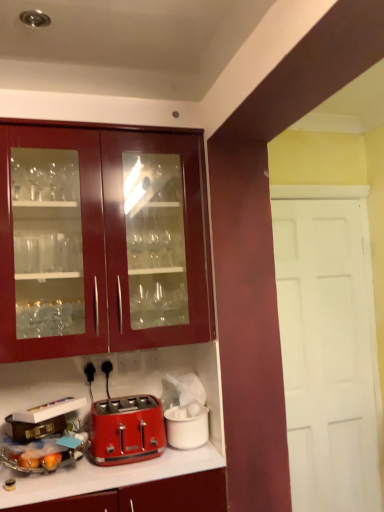
This screenshot has width=384, height=512. What do you see at coordinates (126, 430) in the screenshot? I see `shiny red toaster at lower center` at bounding box center [126, 430].

At what (x,y) coordinates should I click in order to perform the action: click on brown leather suitcase at lower left, the first appliance from the left. Please return your answer as a coordinate pair (x, y). The height and width of the screenshot is (512, 384). Looking at the image, I should click on (34, 428).

Find the location of a particular element. the 2nd appliance counting from the left of the shiny red toaster at lower center is located at coordinates (34, 428).

From the image's perspective, relative to brown leather suitcase at lower left, placed as the 3th appliance when sorted from right to left, is shiny red toaster at lower center above or below?

shiny red toaster at lower center is below brown leather suitcase at lower left, placed as the 3th appliance when sorted from right to left.

Is shiny red toaster at lower center wider than brown leather suitcase at lower left, placed as the 3th appliance when sorted from right to left?

Correct, the width of shiny red toaster at lower center exceeds that of brown leather suitcase at lower left, placed as the 3th appliance when sorted from right to left.

In the image, is shiny red toaster at lower center positioned in front of or behind brown leather suitcase at lower left, placed as the 3th appliance when sorted from right to left?

Clearly, shiny red toaster at lower center is behind brown leather suitcase at lower left, placed as the 3th appliance when sorted from right to left.

From the image's perspective, is matte red toaster at lower left, which is the second appliance from right to left, over white matte ice bucket at lower center, which appears as the third appliance when viewed from the left?

No, from the image's perspective, matte red toaster at lower left, which is the second appliance from right to left, is not on top of white matte ice bucket at lower center, which appears as the third appliance when viewed from the left.

Is matte red toaster at lower left, which is the second appliance from right to left, wider or thinner than white matte ice bucket at lower center, which ranks as the 1th appliance in right-to-left order?

In the image, matte red toaster at lower left, which is the second appliance from right to left, appears to be more narrow than white matte ice bucket at lower center, which ranks as the 1th appliance in right-to-left order.

Choose the correct answer: Is matte red toaster at lower left, which is counted as the second appliance, starting from the left, inside white matte ice bucket at lower center, which ranks as the 1th appliance in right-to-left order, or outside it?

matte red toaster at lower left, which is counted as the second appliance, starting from the left, is spatially situated outside white matte ice bucket at lower center, which ranks as the 1th appliance in right-to-left order.

Between matte red toaster at lower left, which is the second appliance from right to left, and white matte ice bucket at lower center, which appears as the third appliance when viewed from the left, which one is positioned behind?

Positioned behind is white matte ice bucket at lower center, which appears as the third appliance when viewed from the left.

Does shiny red toaster at lower center have a greater width compared to matte red toaster at lower left, which is the second appliance from right to left?

Yes.

Considering the sizes of shiny red toaster at lower center and matte red toaster at lower left, which is counted as the second appliance, starting from the left, in the image, is shiny red toaster at lower center taller or shorter than matte red toaster at lower left, which is counted as the second appliance, starting from the left,?

shiny red toaster at lower center is taller than matte red toaster at lower left, which is counted as the second appliance, starting from the left.

Which appliance is the 1st one when counting from the left side of the shiny red toaster at lower center? Please provide its 2D coordinates.

[(42, 438)]

Is glossy wood cabinet at upper left to the right of matte red toaster at lower left, which is counted as the second appliance, starting from the left, from the viewer's perspective?

Indeed, glossy wood cabinet at upper left is positioned on the right side of matte red toaster at lower left, which is counted as the second appliance, starting from the left.

Is glossy wood cabinet at upper left oriented away from matte red toaster at lower left, which is counted as the second appliance, starting from the left?

No, matte red toaster at lower left, which is counted as the second appliance, starting from the left, is not at the back of glossy wood cabinet at upper left.

Between point (22, 246) and point (6, 441), which one is positioned behind?

The point (6, 441) is farther from the camera.

Measure the distance from glossy wood cabinet at upper left to matte red toaster at lower left, which is counted as the second appliance, starting from the left.

23.52 inches.

Between glossy wood cabinet at upper left and white matte ice bucket at lower center, which ranks as the 1th appliance in right-to-left order, which one has less height?

white matte ice bucket at lower center, which ranks as the 1th appliance in right-to-left order, is shorter.

Does glossy wood cabinet at upper left have a smaller size compared to white matte ice bucket at lower center, which ranks as the 1th appliance in right-to-left order?

No, glossy wood cabinet at upper left is not smaller than white matte ice bucket at lower center, which ranks as the 1th appliance in right-to-left order.

Is glossy wood cabinet at upper left directly adjacent to white matte ice bucket at lower center, which appears as the third appliance when viewed from the left?

No.

Considering the positions of objects glossy wood cabinet at upper left and white matte ice bucket at lower center, which appears as the third appliance when viewed from the left, in the image provided, who is more to the left, glossy wood cabinet at upper left or white matte ice bucket at lower center, which appears as the third appliance when viewed from the left,?

glossy wood cabinet at upper left is more to the left.

Which object is positioned more to the left, brown leather suitcase at lower left, placed as the 3th appliance when sorted from right to left, or glossy wood cabinet at upper left?

From the viewer's perspective, brown leather suitcase at lower left, placed as the 3th appliance when sorted from right to left, appears more on the left side.

At what (x,y) coordinates should I click in order to perform the action: click on cabinetry on the right of brown leather suitcase at lower left, the first appliance from the left. Please return your answer as a coordinate pair (x, y). Looking at the image, I should click on (102, 241).

Is brown leather suitcase at lower left, placed as the 3th appliance when sorted from right to left, oriented towards glossy wood cabinet at upper left?

No, brown leather suitcase at lower left, placed as the 3th appliance when sorted from right to left, is not turned towards glossy wood cabinet at upper left.

Could glossy wood cabinet at upper left be considered to be inside brown leather suitcase at lower left, the first appliance from the left?

No, glossy wood cabinet at upper left is not a part of brown leather suitcase at lower left, the first appliance from the left.

Is brown leather suitcase at lower left, the first appliance from the left, situated inside shiny red toaster at lower center or outside?

brown leather suitcase at lower left, the first appliance from the left, is outside shiny red toaster at lower center.

Can you tell me how much brown leather suitcase at lower left, the first appliance from the left, and shiny red toaster at lower center differ in facing direction?

The facing directions of brown leather suitcase at lower left, the first appliance from the left, and shiny red toaster at lower center are 7.18 degrees apart.

From the picture: Is brown leather suitcase at lower left, placed as the 3th appliance when sorted from right to left, positioned behind shiny red toaster at lower center?

No, it is not.

Identify the location of toaster behind the brown leather suitcase at lower left, placed as the 3th appliance when sorted from right to left. The image size is (384, 512). (126, 430).

I want to click on appliance that is under the white matte ice bucket at lower center, which appears as the third appliance when viewed from the left (from a real-world perspective), so coord(42,438).

From the image, which object appears to be nearer to white matte ice bucket at lower center, which ranks as the 1th appliance in right-to-left order, shiny red toaster at lower center or brown leather suitcase at lower left, placed as the 3th appliance when sorted from right to left?

shiny red toaster at lower center.

When comparing their distances from white matte ice bucket at lower center, which ranks as the 1th appliance in right-to-left order, does brown leather suitcase at lower left, placed as the 3th appliance when sorted from right to left, or matte red toaster at lower left, which is the second appliance from right to left, seem closer?

matte red toaster at lower left, which is the second appliance from right to left, is closer to white matte ice bucket at lower center, which ranks as the 1th appliance in right-to-left order.

Considering their positions, is matte red toaster at lower left, which is counted as the second appliance, starting from the left, positioned closer to brown leather suitcase at lower left, the first appliance from the left, than glossy wood cabinet at upper left?

Based on the image, matte red toaster at lower left, which is counted as the second appliance, starting from the left, appears to be nearer to brown leather suitcase at lower left, the first appliance from the left.

Which object lies further to the anchor point brown leather suitcase at lower left, placed as the 3th appliance when sorted from right to left, glossy wood cabinet at upper left or shiny red toaster at lower center?

The object further to brown leather suitcase at lower left, placed as the 3th appliance when sorted from right to left, is glossy wood cabinet at upper left.

When comparing their distances from matte red toaster at lower left, which is counted as the second appliance, starting from the left, does white matte ice bucket at lower center, which appears as the third appliance when viewed from the left, or brown leather suitcase at lower left, placed as the 3th appliance when sorted from right to left, seem further?

white matte ice bucket at lower center, which appears as the third appliance when viewed from the left, is positioned further to the anchor matte red toaster at lower left, which is counted as the second appliance, starting from the left.

Estimate the real-world distances between objects in this image. Which object is closer to brown leather suitcase at lower left, the first appliance from the left, white matte ice bucket at lower center, which ranks as the 1th appliance in right-to-left order, or matte red toaster at lower left, which is counted as the second appliance, starting from the left?

matte red toaster at lower left, which is counted as the second appliance, starting from the left, lies closer to brown leather suitcase at lower left, the first appliance from the left, than the other object.

Considering their positions, is matte red toaster at lower left, which is counted as the second appliance, starting from the left, positioned closer to white matte ice bucket at lower center, which ranks as the 1th appliance in right-to-left order, than glossy wood cabinet at upper left?

Based on the image, matte red toaster at lower left, which is counted as the second appliance, starting from the left, appears to be nearer to white matte ice bucket at lower center, which ranks as the 1th appliance in right-to-left order.

Estimate the real-world distances between objects in this image. Which object is further from white matte ice bucket at lower center, which ranks as the 1th appliance in right-to-left order, shiny red toaster at lower center or glossy wood cabinet at upper left?

glossy wood cabinet at upper left.

You are a GUI agent. You are given a task and a screenshot of the screen. Output one action in this format:
    pyautogui.click(x=<x>, y=<y>)
    Task: Click on the toaster between brown leather suitcase at lower left, placed as the 3th appliance when sorted from right to left, and white matte ice bucket at lower center, which appears as the third appliance when viewed from the left, from left to right
    
    Given the screenshot: What is the action you would take?
    pyautogui.click(x=126, y=430)

Image resolution: width=384 pixels, height=512 pixels. Find the location of `toaster located between matte red toaster at lower left, which is the second appliance from right to left, and white matte ice bucket at lower center, which appears as the third appliance when viewed from the left, in the left-right direction`. toaster located between matte red toaster at lower left, which is the second appliance from right to left, and white matte ice bucket at lower center, which appears as the third appliance when viewed from the left, in the left-right direction is located at coordinates click(126, 430).

The width and height of the screenshot is (384, 512). Identify the location of toaster between glossy wood cabinet at upper left and white matte ice bucket at lower center, which ranks as the 1th appliance in right-to-left order, in the vertical direction. (126, 430).

Where is `toaster between glossy wood cabinet at upper left and matte red toaster at lower left, which is the second appliance from right to left, in the up-down direction`? Image resolution: width=384 pixels, height=512 pixels. toaster between glossy wood cabinet at upper left and matte red toaster at lower left, which is the second appliance from right to left, in the up-down direction is located at coordinates (126, 430).